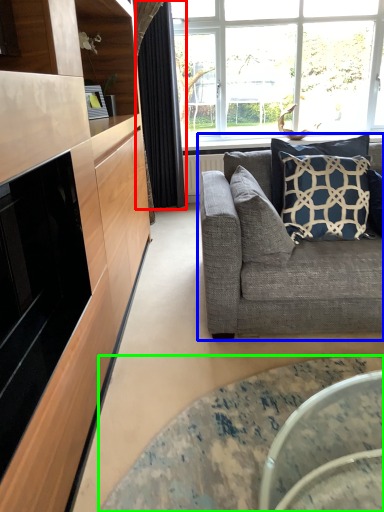
Question: Considering the real-world distances, which object is farthest from curtain (highlighted by a red box)? studio couch (highlighted by a blue box) or coffee table (highlighted by a green box)?

Choices:
 (A) studio couch
 (B) coffee table

Answer: (B)